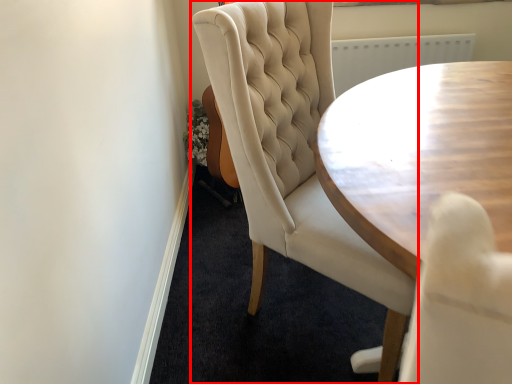
Question: From the image's perspective, what is the correct spatial relationship of chair (annotated by the red box) in relation to coffee table?

Choices:
 (A) below
 (B) above

Answer: (B)